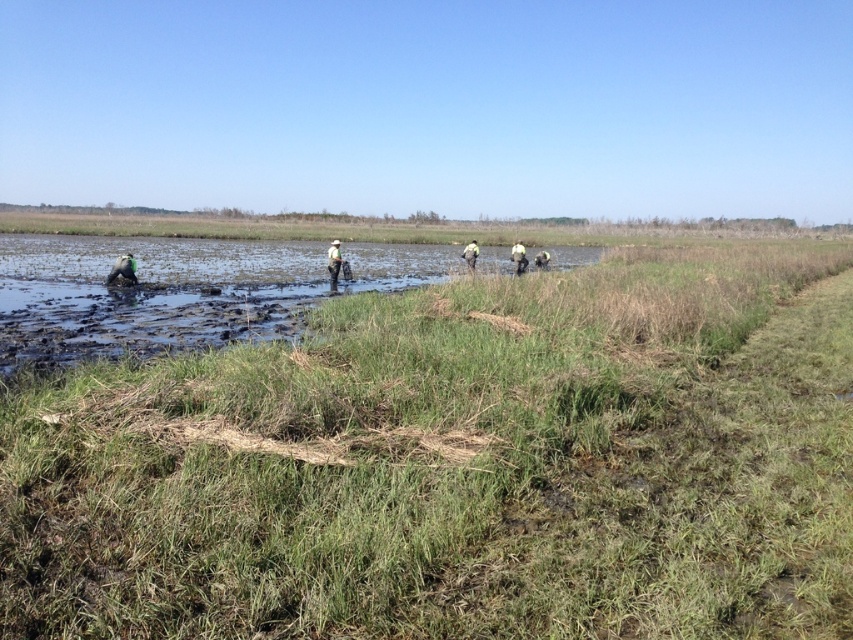
You are a safety inspector assessing the workers in the marshy wetland. You notice two items worn by the workers at the center of the scene. Which item is narrower between the green fabric jacket at center and the yellow reflective vest at center?

The green fabric jacket at center is narrower than the yellow reflective vest at center.

Consider the image. You are standing at the point marked by the coordinates point (x=457, y=467) in the marshy wetland scene. What type of ground surface are you currently standing on?

You are standing on green grass at center as the point (x=457, y=467) is located there according to the description.

You are a drone operator tasked with capturing aerial footage of the green grass at center and the yellow fabric person at center in the marshy wetland. Based on the scene, which object occupies a larger area in the image?

The green grass at center might be wider than the yellow fabric person at center, so the green grass at center likely occupies a larger area in the image.